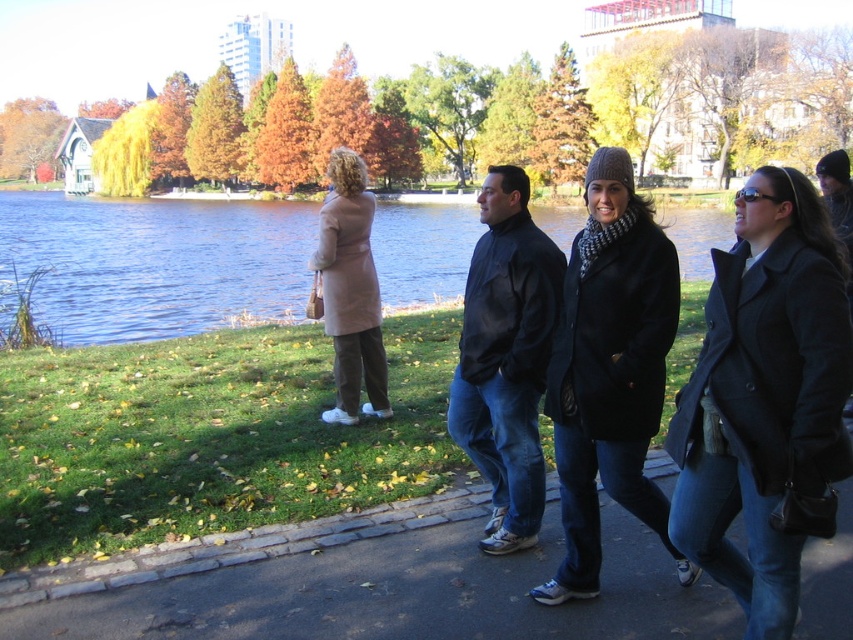
You are standing at the edge of the pathway in the park and see the dark gray wool coat at center and the blue water at center. Which object is closer to you?

The dark gray wool coat at center is closer to you because it is positioned under the blue water at center, indicating it is nearer in the visual plane.

You are standing on the pathway in the park and see the dark gray wool coat at center and the blue water at center. Which object is nearer to you?

The dark gray wool coat at center is closer to the viewer than the blue water at center.

In the scene shown: You are a photographer planning to take a group photo of the dark gray wool coat at center and the dark blue jacket at center. Which of these two items has a narrower silhouette?

The dark gray wool coat at center is thinner than the dark blue jacket at center, so the dark gray wool coat at center has a narrower silhouette.